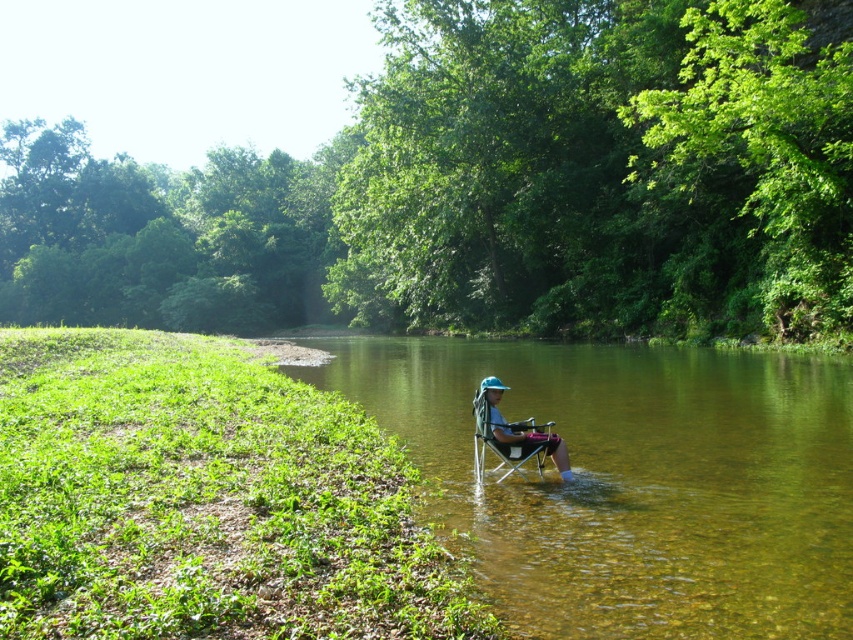
You are standing on the grassy bank and want to place a small fishing net in the water near the matte blue chair at center. Based on the scene, where should you place the net to ensure it is in the clear water at chair right?

Place the net to the right of the matte blue chair at center, as the clear water at chair right is located to the right of the matte blue chair at center.

You are planning to wade into the river from the grassy bank. The clear water at chair right and the matte blue chair at center are in your path. Which one do you need to avoid stepping on first?

The clear water at chair right is bigger than the matte blue chair at center, so you should avoid stepping on the clear water at chair right first as it covers a larger area in your path.